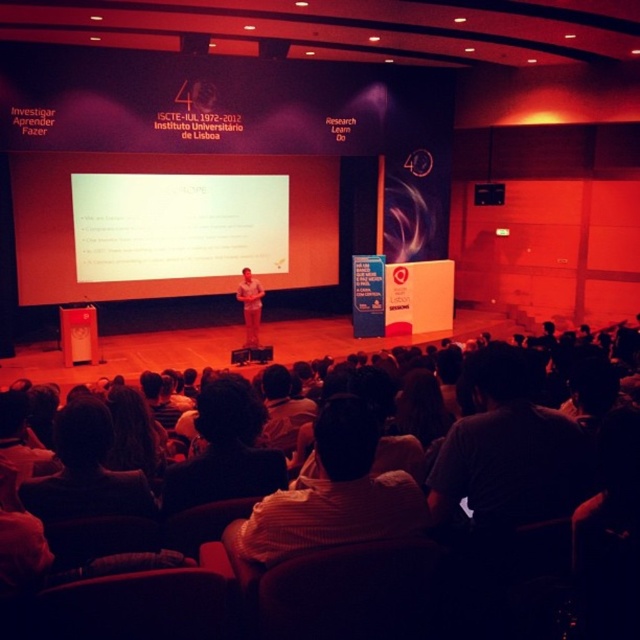
Which of these two, dark gray shirt at lower right or striped shirt at center, stands shorter?

Standing shorter between the two is striped shirt at center.

Based on the photo, does dark gray shirt at lower right lie behind striped shirt at center?

Yes, it is.

Who is more distant from viewer, (492,492) or (314,486)?

The point (492,492) is more distant.

Image resolution: width=640 pixels, height=640 pixels. Identify the location of dark gray shirt at lower right. (508, 451).

Does white matte projection screen at center appear on the right side of dark gray shirt at lower right?

Incorrect, white matte projection screen at center is not on the right side of dark gray shirt at lower right.

Consider the image. Between white matte projection screen at center and dark gray shirt at lower right, which one is positioned lower?

Positioned lower is dark gray shirt at lower right.

This screenshot has width=640, height=640. I want to click on white matte projection screen at center, so click(164, 173).

At what (x,y) coordinates should I click in order to perform the action: click on white matte projection screen at center. Please return your answer as a coordinate pair (x, y). This screenshot has width=640, height=640. Looking at the image, I should click on (164, 173).

Between white matte projection screen at center and striped shirt at center, which one appears on the right side from the viewer's perspective?

From the viewer's perspective, striped shirt at center appears more on the right side.

Which is more to the left, white matte projection screen at center or striped shirt at center?

white matte projection screen at center

What do you see at coordinates (164, 173) in the screenshot?
I see `white matte projection screen at center` at bounding box center [164, 173].

What are the coordinates of `white matte projection screen at center` in the screenshot? It's located at [164, 173].